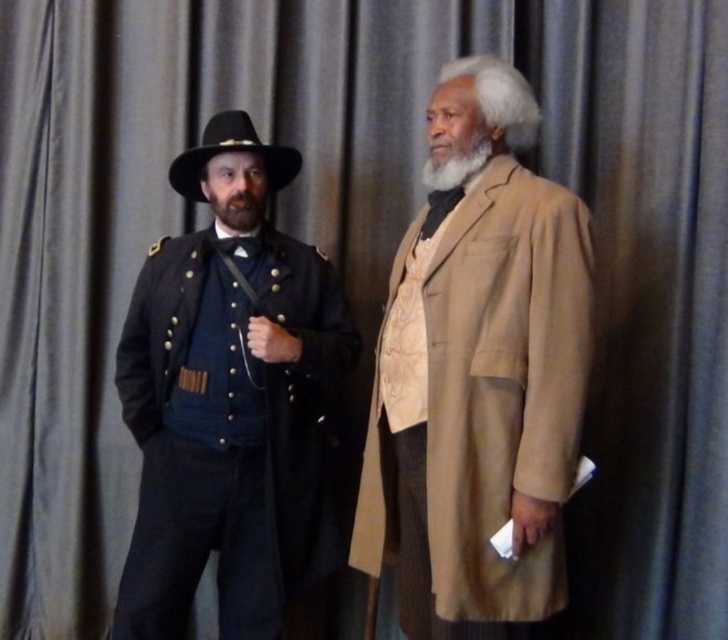
Is beige wool coat at right shorter than black felt cowboy hat at left?

No.

Can you confirm if beige wool coat at right is positioned above black felt cowboy hat at left?

No.

The image size is (728, 640). What do you see at coordinates (478, 378) in the screenshot?
I see `beige wool coat at right` at bounding box center [478, 378].

This screenshot has height=640, width=728. Identify the location of beige wool coat at right. (478, 378).

Is point (341, 294) positioned after point (250, 141)?

Yes, it is.

Between matte blue uniform at left and black felt cowboy hat at left, which one appears on the left side from the viewer's perspective?

Positioned to the left is matte blue uniform at left.

Does point (183, 317) come in front of point (185, 166)?

Yes, it is in front of point (185, 166).

Identify the location of matte blue uniform at left. (229, 426).

Does matte blue uniform at left have a lesser height compared to graywoollybeard at right?

Incorrect, matte blue uniform at left's height does not fall short of graywoollybeard at right's.

Is the position of matte blue uniform at left more distant than that of graywoollybeard at right?

Yes, matte blue uniform at left is further from the viewer.

Between point (269, 630) and point (448, 186), which one is positioned behind?

The point (269, 630) is behind.

Find the location of a particular element. The image size is (728, 640). matte blue uniform at left is located at coordinates pyautogui.click(x=229, y=426).